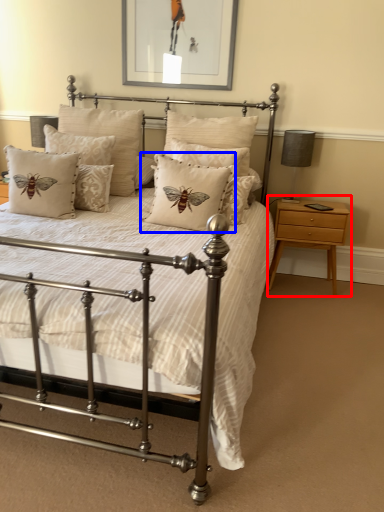
Question: Which object is further to the camera taking this photo, nightstand (highlighted by a red box) or pillow (highlighted by a blue box)?

Choices:
 (A) nightstand
 (B) pillow

Answer: (A)